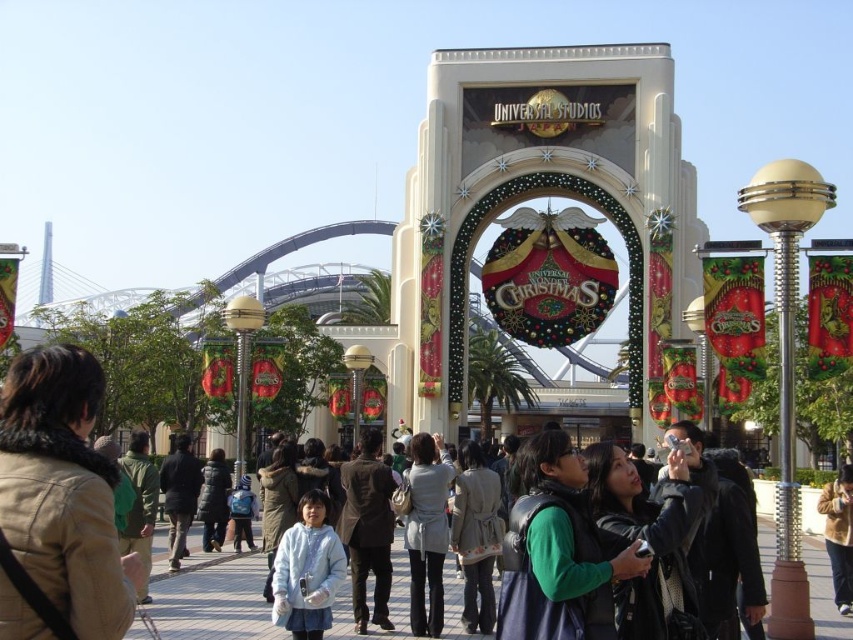
Is tan leather jacket at left further to camera compared to light blue fleece jacket at center?

No, it is in front of light blue fleece jacket at center.

Who is positioned more to the right, tan leather jacket at left or light blue fleece jacket at center?

From the viewer's perspective, light blue fleece jacket at center appears more on the right side.

Where is `tan leather jacket at left`? This screenshot has height=640, width=853. tan leather jacket at left is located at coordinates (57, 506).

Measure the distance between point (383, 472) and camera.

Point (383, 472) and camera are 112.10 meters apart from each other.

Looking at this image, is dark brown suit at center bigger than light blue fleece jacket at center?

Correct, dark brown suit at center is larger in size than light blue fleece jacket at center.

This screenshot has width=853, height=640. What do you see at coordinates (367, 529) in the screenshot? I see `dark brown suit at center` at bounding box center [367, 529].

This screenshot has height=640, width=853. I want to click on dark brown suit at center, so click(x=367, y=529).

Who is more forward, (477, 445) or (134, 538)?

Point (134, 538) is more forward.

Which is behind, point (450, 529) or point (155, 490)?

The point (155, 490) is more distant.

You are a GUI agent. You are given a task and a screenshot of the screen. Output one action in this format:
    pyautogui.click(x=<x>, y=<y>)
    Task: Click on the light blue denim jacket at center
    The image size is (853, 640).
    Given the screenshot: What is the action you would take?
    [476, 536]